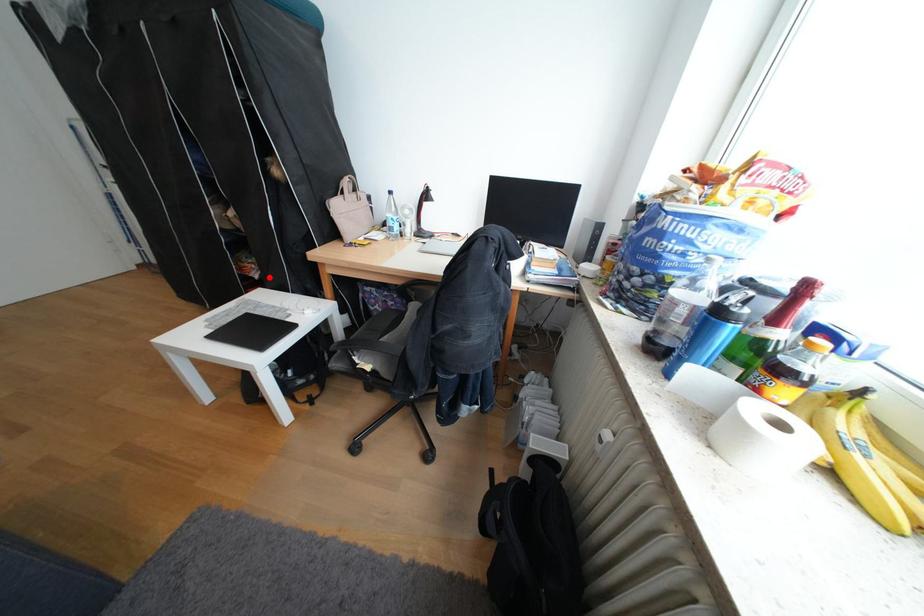
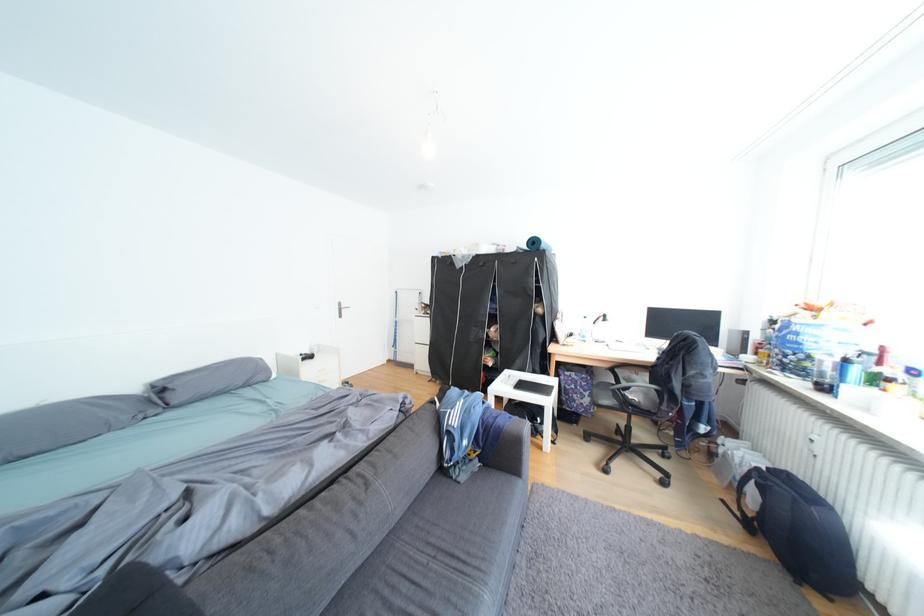
Locate, in the second image, the point that corresponds to the highlighted location in the first image.

(504, 365)